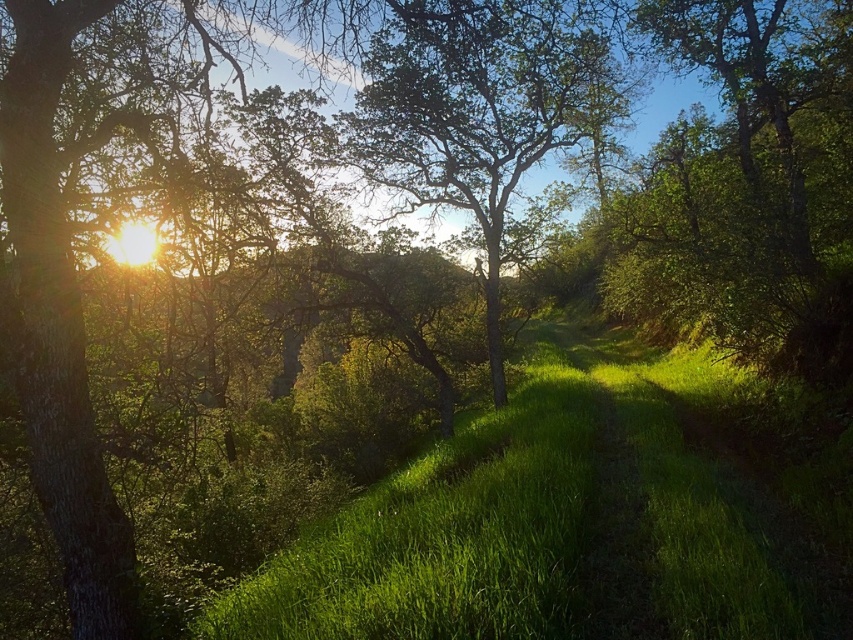
Question: Which point is farther to the camera?

Choices:
 (A) green leafy tree at center
 (B) green grassy trail at center
 (C) green grassy path at center

Answer: (A)

Question: Considering the relative positions of green leafy tree at center and green grassy trail at center in the image provided, where is green leafy tree at center located with respect to green grassy trail at center?

Choices:
 (A) right
 (B) left

Answer: (B)

Question: Which point appears farthest from the camera in this image?

Choices:
 (A) [x=686, y=573]
 (B) [x=585, y=336]

Answer: (B)

Question: Does green grassy path at center have a greater width compared to green leafy tree at center?

Choices:
 (A) no
 (B) yes

Answer: (B)

Question: Estimate the real-world distances between objects in this image. Which object is farther from the green grassy trail at center?

Choices:
 (A) green grassy path at center
 (B) green leafy tree at center

Answer: (B)

Question: Is green grassy path at center smaller than green grassy trail at center?

Choices:
 (A) yes
 (B) no

Answer: (B)